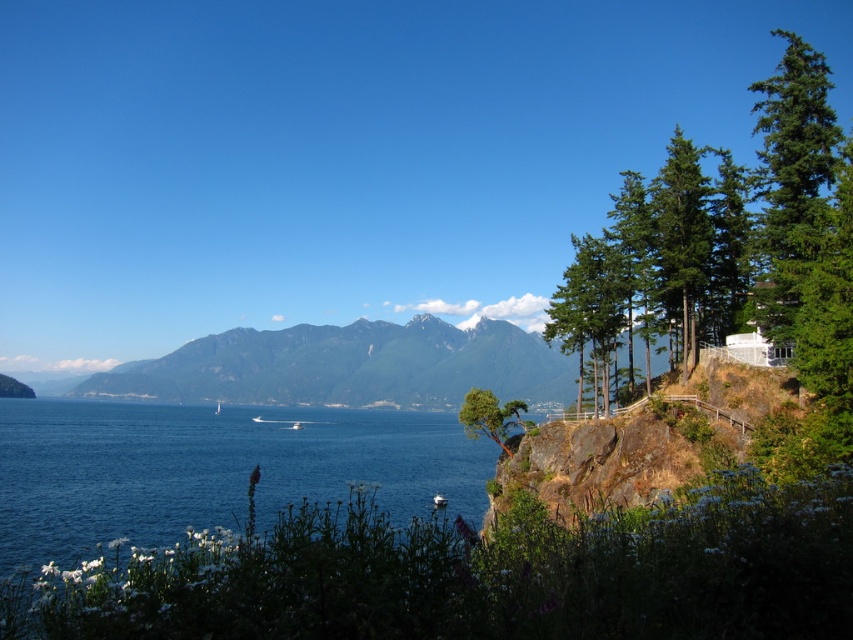
You are standing at the base of the cliff and want to reach the blue water at lower left without getting wet. The green textured tree at upper right is blocking your path. Can you go around it to reach the water?

The blue water at lower left is located below the green textured tree at upper right, so you can go around the tree to reach the water as it is positioned above the water.

You are a painter standing at the edge of the cliff, wanting to paint the green matte trees at right and the green rough bark tree at upper right. Which tree has a wider base?

The green matte trees at right has a larger width than the green rough bark tree at upper right, so the green matte trees at right has a wider base.

You are standing at the base of the cliff in the coastal landscape. You see a point marked at coordinates (791, 177). What object is located at that point?

The point at coordinates (791, 177) marks the green evergreen tree at upper right.